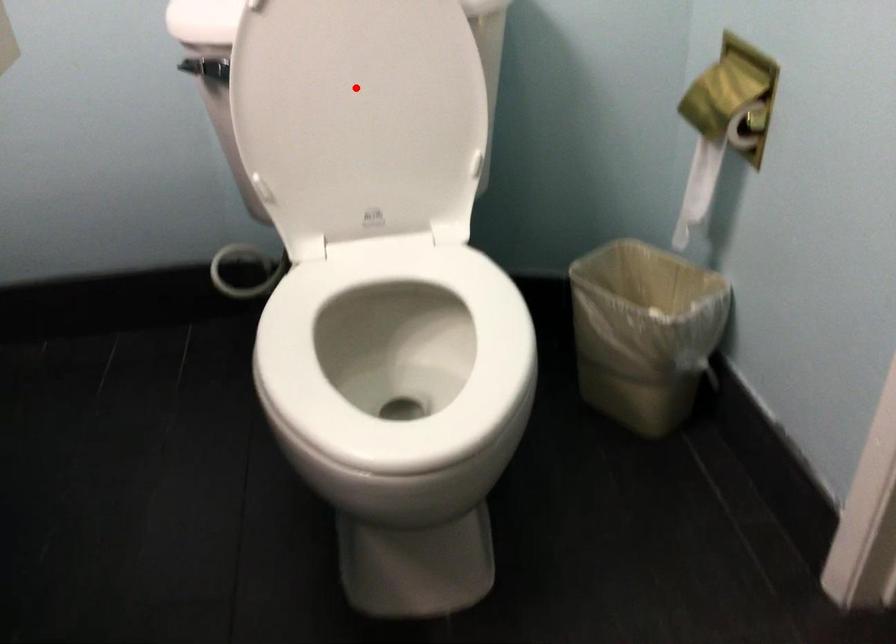
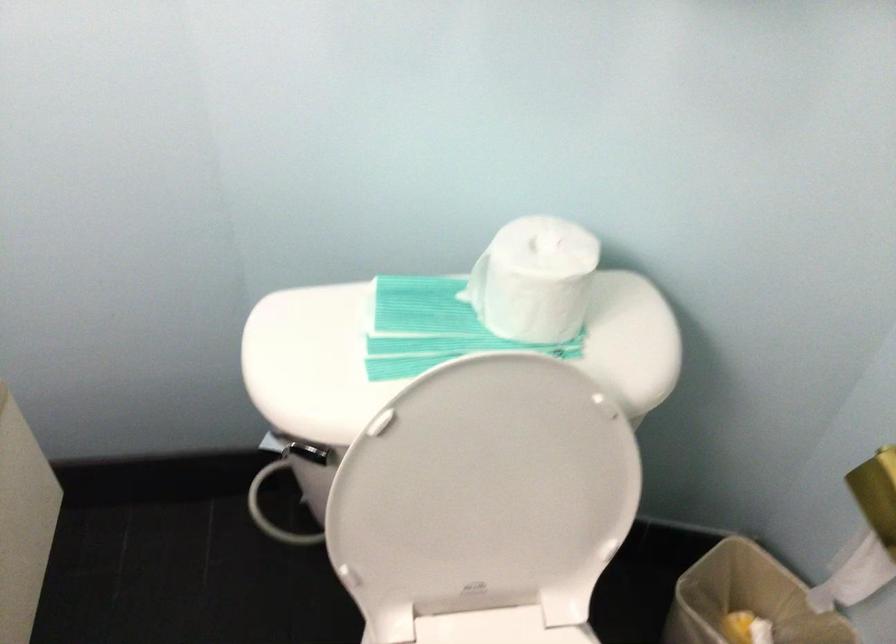
Where in the second image is the point corresponding to the highlighted location from the first image?

(486, 496)